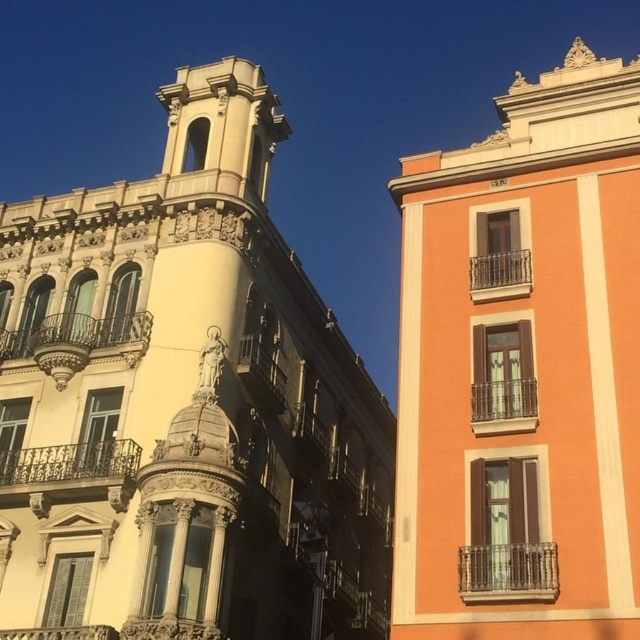
You are a bird flying over the city and want to land on the highest point between the matte gold bell tower at center and the matte orange building at upper right. Which one should you choose?

The matte orange building at upper right is higher than the matte gold bell tower at center, so you should land on the matte orange building at upper right.

You are standing at the base of the matte gold bell tower at center. You want to throw a ball to your friend who is standing at the base of the building on the right. The ball can travel 100 feet. Will it reach your friend?

The matte gold bell tower at center and viewer are 110.34 feet apart, so the distance is greater than the ball can travel. The ball will not reach your friend.

You are standing at the entrance of the building on the left. You want to walk straight ahead towards the building on the right. Will the matte gold bell tower at center block your path?

The matte gold bell tower at center is located at coordinates point (184, 404), so it is positioned to the right of the central axis of the image. Since you are starting from the entrance of the building on the left and walking straight towards the building on the right, your path would be along the central axis. Therefore, the matte gold bell tower at center is slightly to the right of your path and would not block your way directly. However, depending on the exact alignment of the entrance and the tower